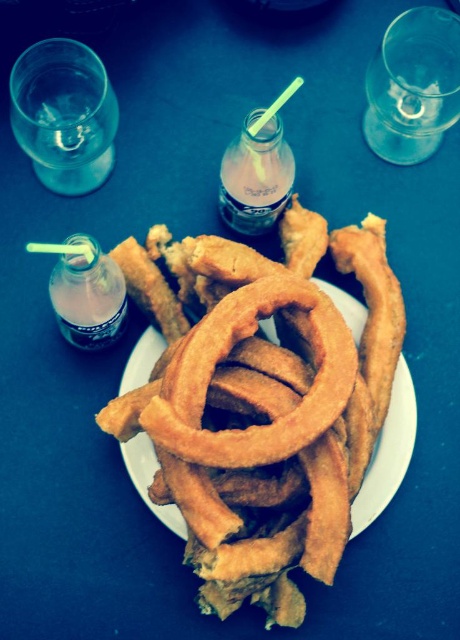
Question: Which point is closer to the camera?

Choices:
 (A) golden crispy onion rings at center
 (B) translucent plastic bottle at left
 (C) translucent plastic bottle at center

Answer: (A)

Question: Considering the real-world distances, which object is closest to the golden crispy onion rings at center?

Choices:
 (A) translucent plastic bottle at left
 (B) translucent plastic bottle at center

Answer: (A)

Question: Does golden crispy onion rings at center have a greater width compared to translucent plastic bottle at center?

Choices:
 (A) no
 (B) yes

Answer: (B)

Question: Can you confirm if golden crispy onion rings at center is bigger than translucent plastic bottle at left?

Choices:
 (A) no
 (B) yes

Answer: (B)

Question: Which point is closer to the camera?

Choices:
 (A) (235, 337)
 (B) (57, 296)

Answer: (A)

Question: Is golden crispy onion rings at center above translucent plastic bottle at left?

Choices:
 (A) no
 (B) yes

Answer: (A)